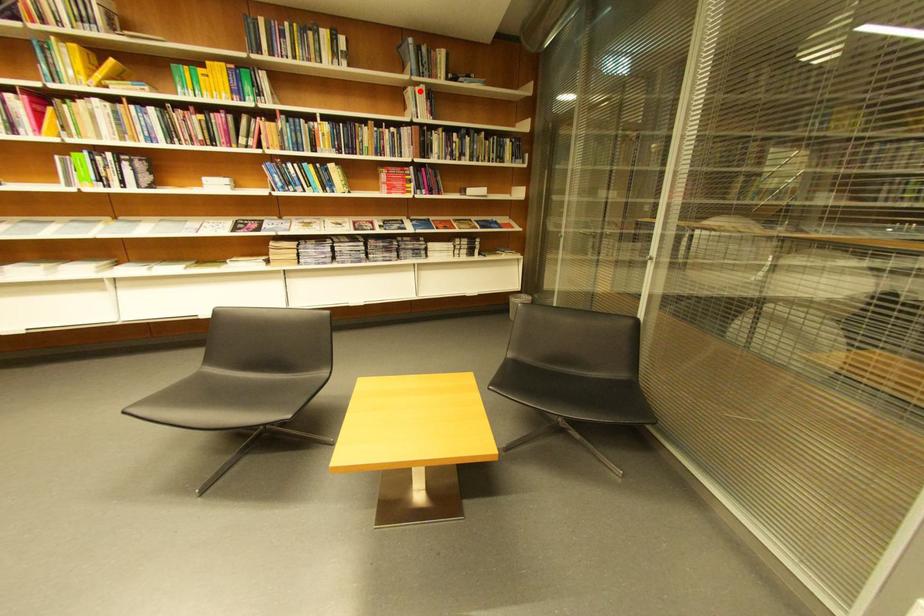
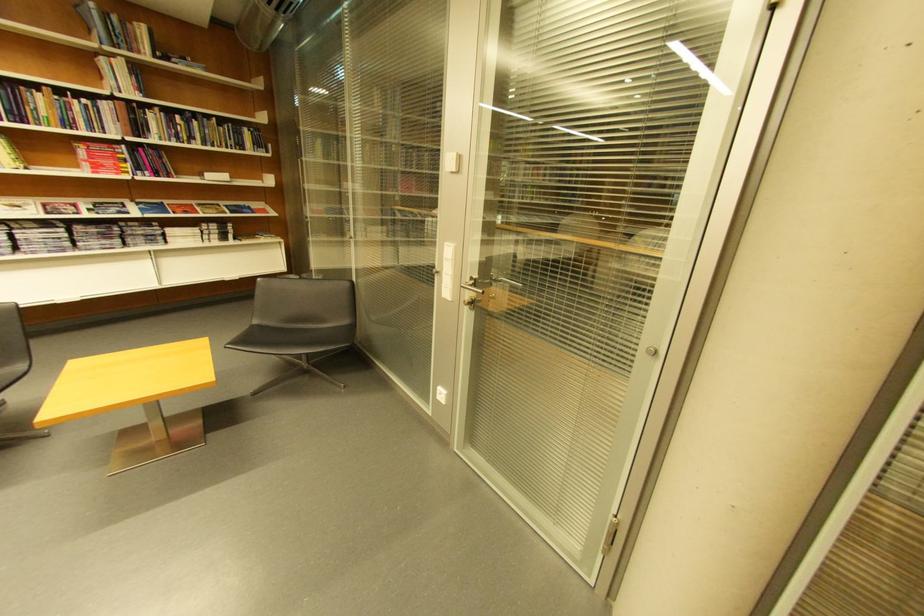
The point at the highlighted location is marked in the first image. Where is the corresponding point in the second image?

(113, 62)